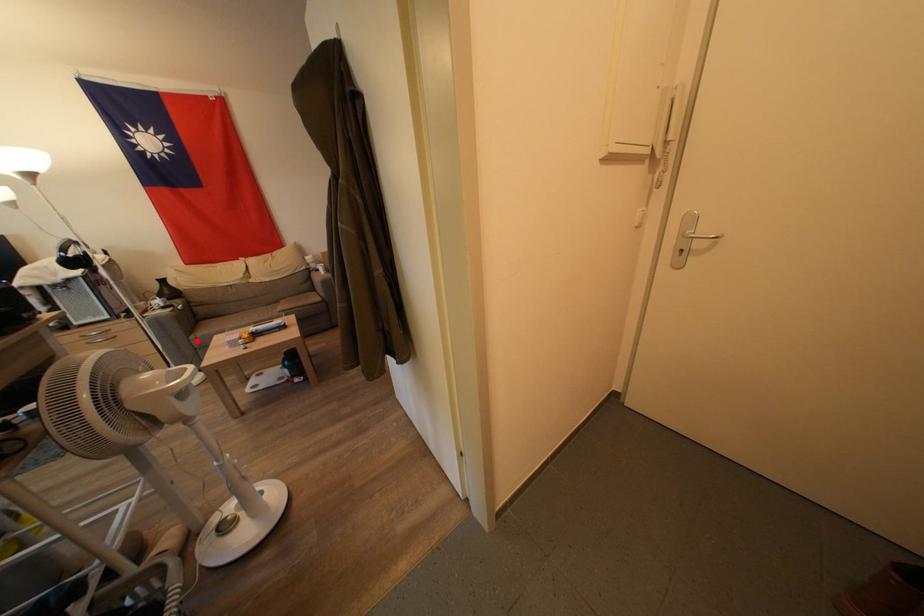
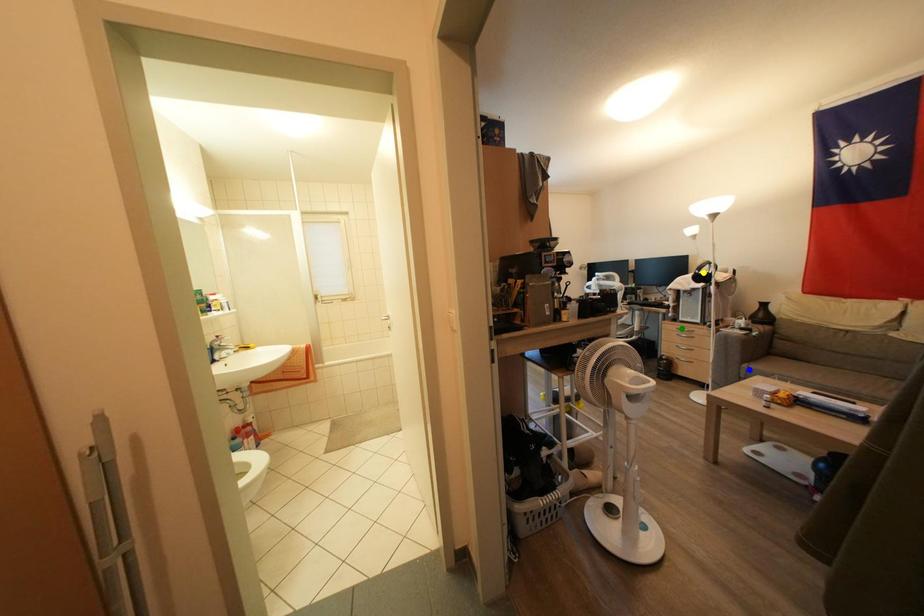
Question: I am providing you with two images of the same scene from different viewpoints. A red point is marked on the first image. You are given multiple points on the second image. In image 2, which mark is for the same physical point as the one in image 1?

Choices:
 (A) green point
 (B) yellow point
 (C) blue point

Answer: (C)